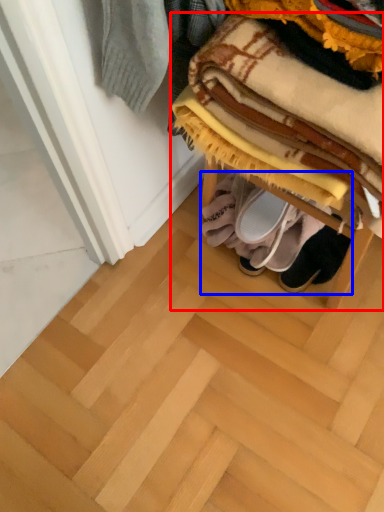
Question: Which point is closer to the camera, furniture (highlighted by a red box) or footwear (highlighted by a blue box)?

Choices:
 (A) furniture
 (B) footwear

Answer: (A)